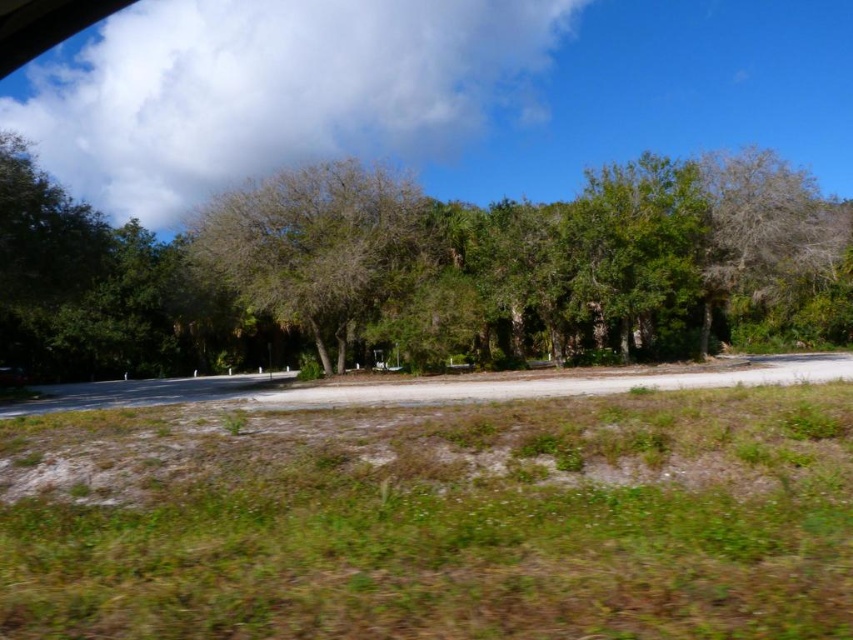
You are a gardener planning to plant a new flower bed. You have two areas to choose from in the scene described. One is the green grass at lower center and the other is the brown textured tree at center. Based on the space available, which area would you recommend for the flower bed and why?

The green grass at lower center occupies less space than the brown textured tree at center. Therefore, the brown textured tree at center area has more available space for planting the flower bed.